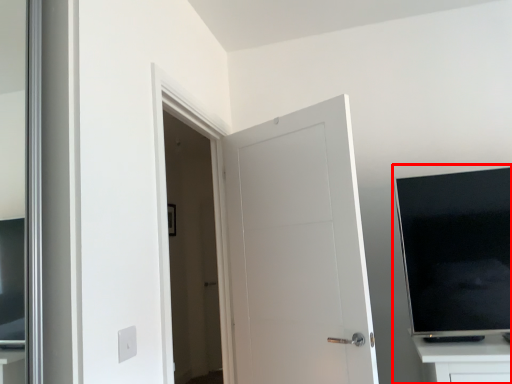
Question: In this image, where is entertainment center (annotated by the red box) located relative to door?

Choices:
 (A) left
 (B) right

Answer: (B)